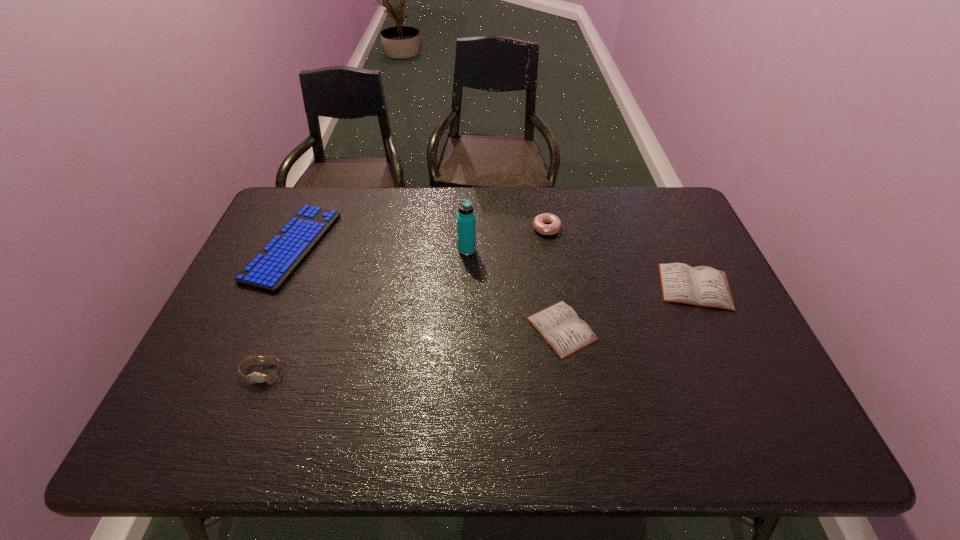
Given the evenly spaced diarys in the image, where should an extra diary be added on the left to preserve the spacing? Please point to a vacant space. Please provide its 2D coordinates. Your answer should be formatted as a tuple, i.e. [(x, y)], where the tuple contains the x and y coordinates of a point satisfying the conditions above.

[(402, 379)]